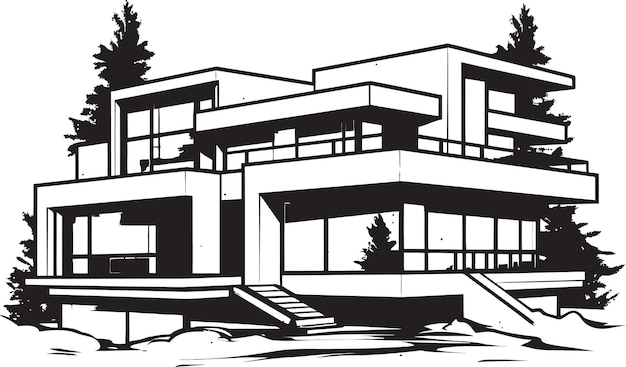
Locate an element on the screen. The height and width of the screenshot is (367, 626). staircase is located at coordinates (289, 303), (495, 298).